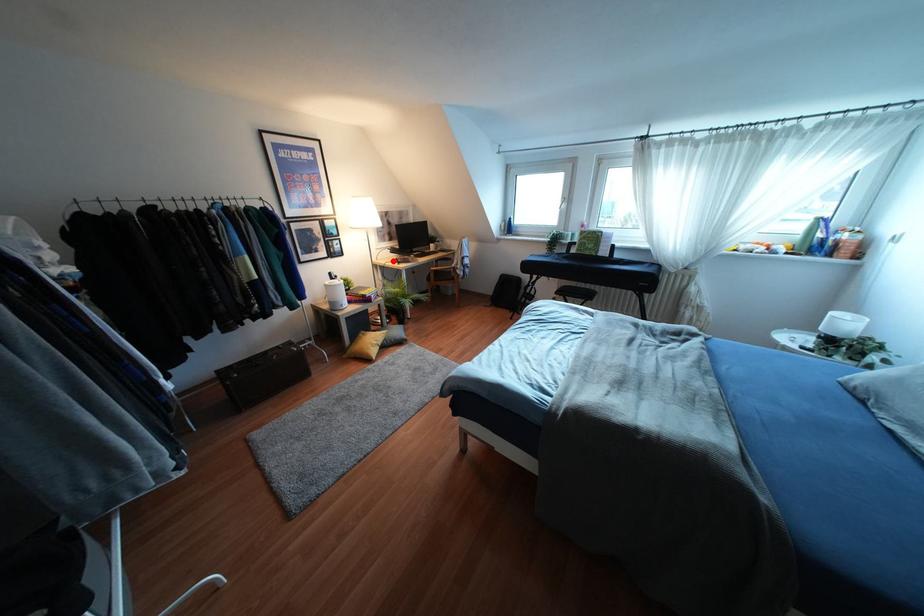
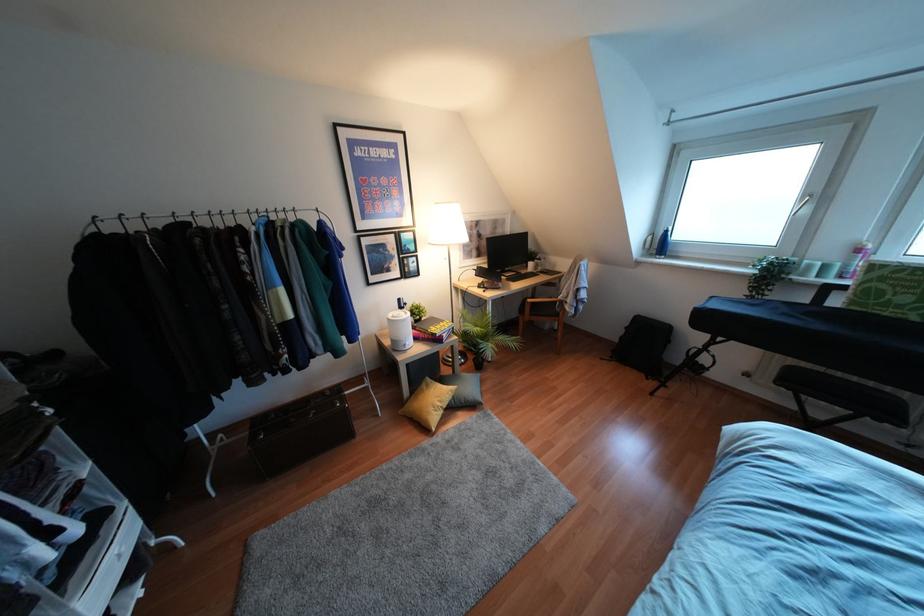
Locate, in the second image, the point that corresponds to the highlighted location in the first image.

(478, 286)